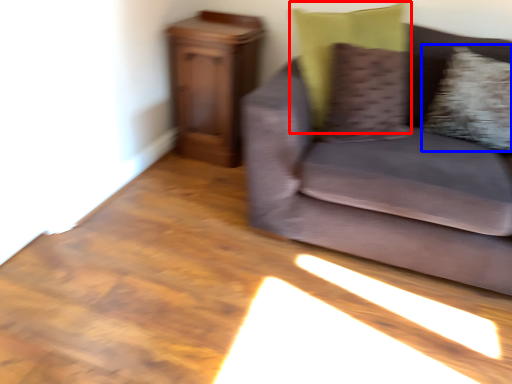
Question: Which of the following is the farthest to the observer, pillow (highlighted by a red box) or pillow (highlighted by a blue box)?

Choices:
 (A) pillow
 (B) pillow

Answer: (B)